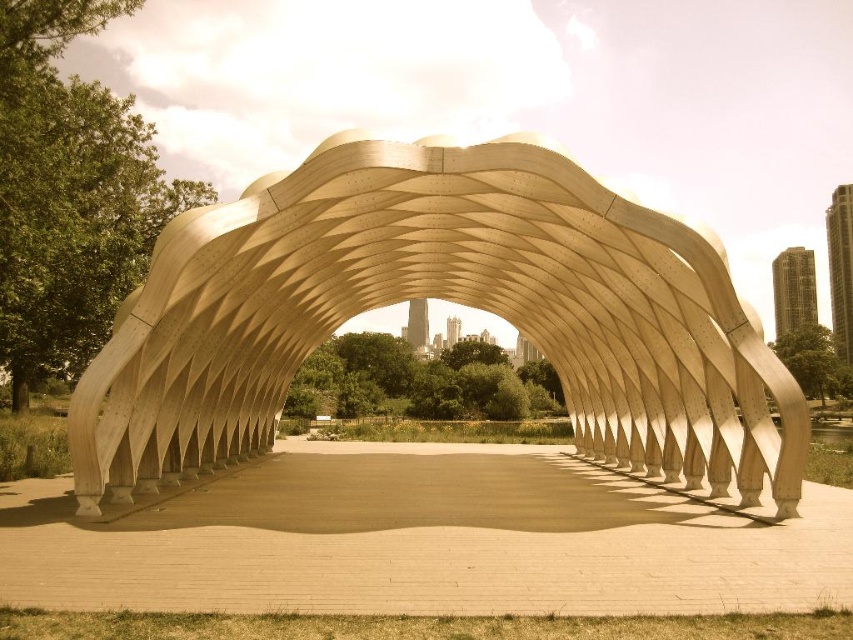
You are a visitor approaching the matte wood structure at center and the smooth concrete path at center. Which object is higher in elevation when you first see them from a distance?

The matte wood structure at center is taller than the smooth concrete path at center, so it is higher in elevation.

You are standing at the entrance of the pavilion and want to reach the point at coordinates point (x=770, y=536). Given that the walkway is 15 meters long, will you be able to reach the point without leaving the walkway?

The point at (x=770, y=536) is 16.22 meters away from the viewer, which exceeds the walkway length of 15 meters. Therefore, you cannot reach the point without leaving the walkway.